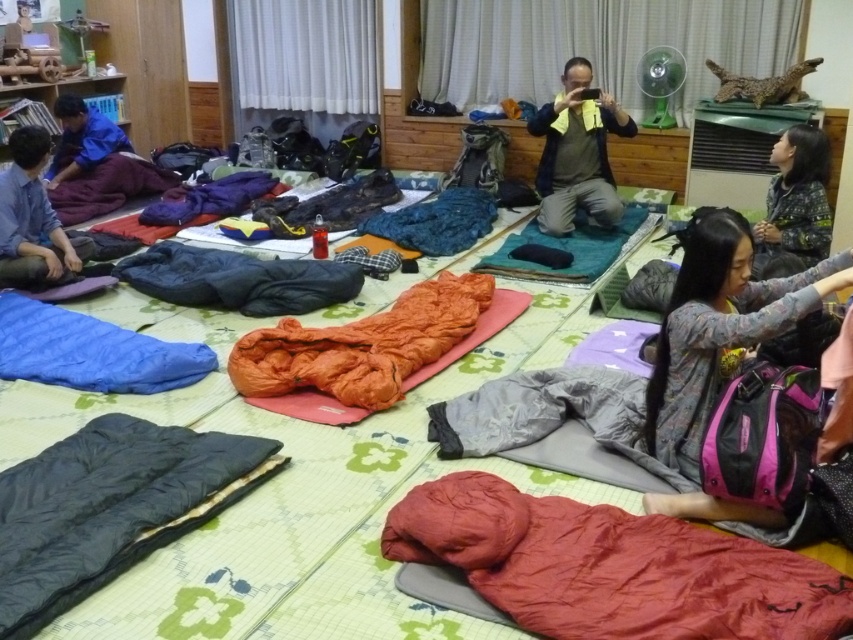
Is pink fabric backpack at lower right to the left of orange fabric sleeping bag at center from the viewer's perspective?

No, pink fabric backpack at lower right is not to the left of orange fabric sleeping bag at center.

You are a GUI agent. You are given a task and a screenshot of the screen. Output one action in this format:
    pyautogui.click(x=<x>, y=<y>)
    Task: Click on the pink fabric backpack at lower right
    The image size is (853, 640).
    Given the screenshot: What is the action you would take?
    pyautogui.click(x=718, y=326)

Does pink fabric backpack at lower right have a lesser height compared to blue fabric sleeping bag at upper left?

No.

Which of these two, pink fabric backpack at lower right or blue fabric sleeping bag at upper left, stands shorter?

Standing shorter between the two is blue fabric sleeping bag at upper left.

Between point (686, 422) and point (83, 112), which one is positioned behind?

The point (83, 112) is behind.

Where is `pink fabric backpack at lower right`? This screenshot has height=640, width=853. pink fabric backpack at lower right is located at coordinates (718, 326).

Is blue denim shirt at left below patterned fabric jacket at right?

Actually, blue denim shirt at left is above patterned fabric jacket at right.

Identify the location of blue denim shirt at left. (32, 220).

Which is behind, point (36, 129) or point (776, 264)?

Positioned behind is point (36, 129).

The height and width of the screenshot is (640, 853). In order to click on blue denim shirt at left in this screenshot , I will do `click(32, 220)`.